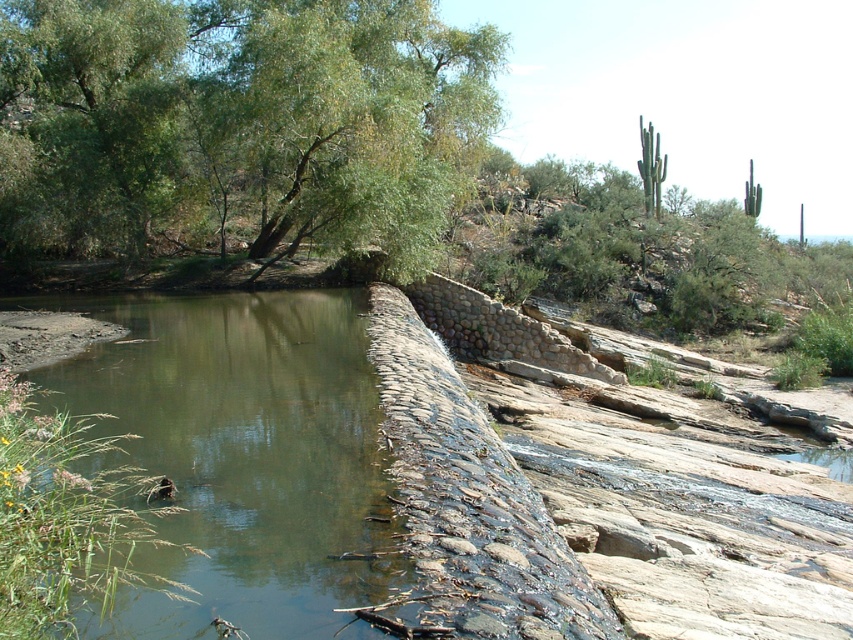
You are standing at the point marked as point (x=238, y=124) in the image. What object is directly in front of you?

The green leafy tree at upper left is located at point (x=238, y=124), so the object directly in front of you is the green leafy tree at upper left.